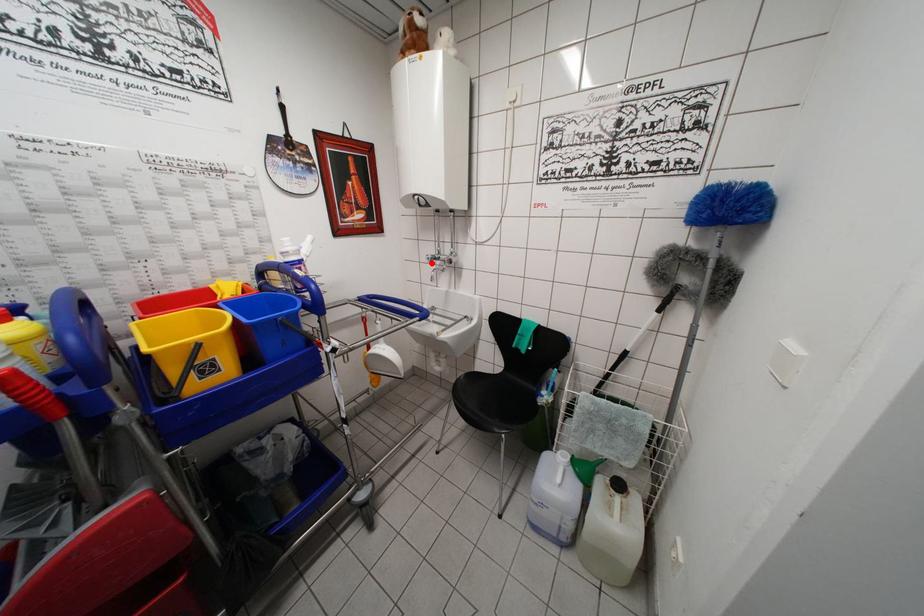
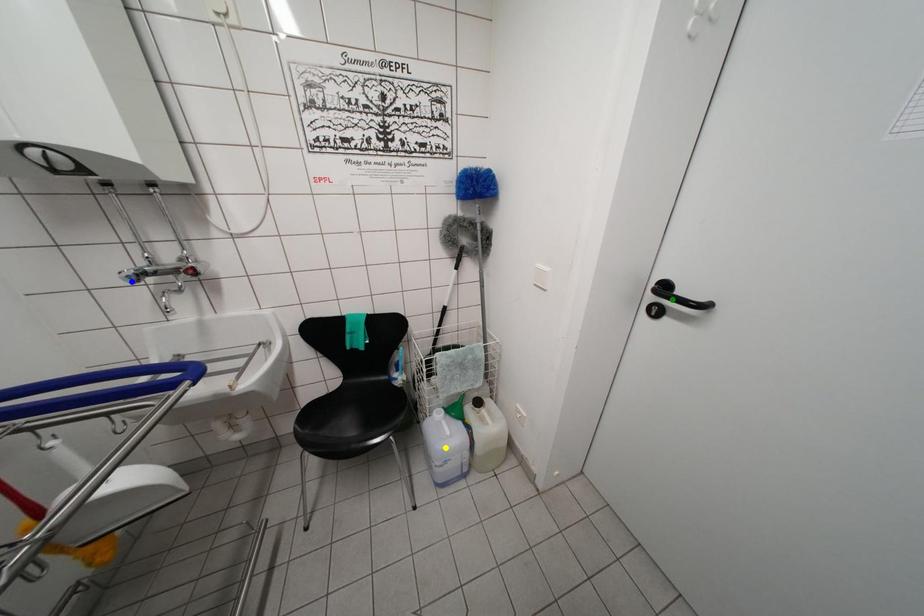
Question: I am providing you with two images of the same scene from different viewpoints. A red point is marked on the first image. You are given multiple points on the second image. Which spot in image 2 lines up with the point in image 1?

Choices:
 (A) blue point
 (B) yellow point
 (C) green point

Answer: (A)